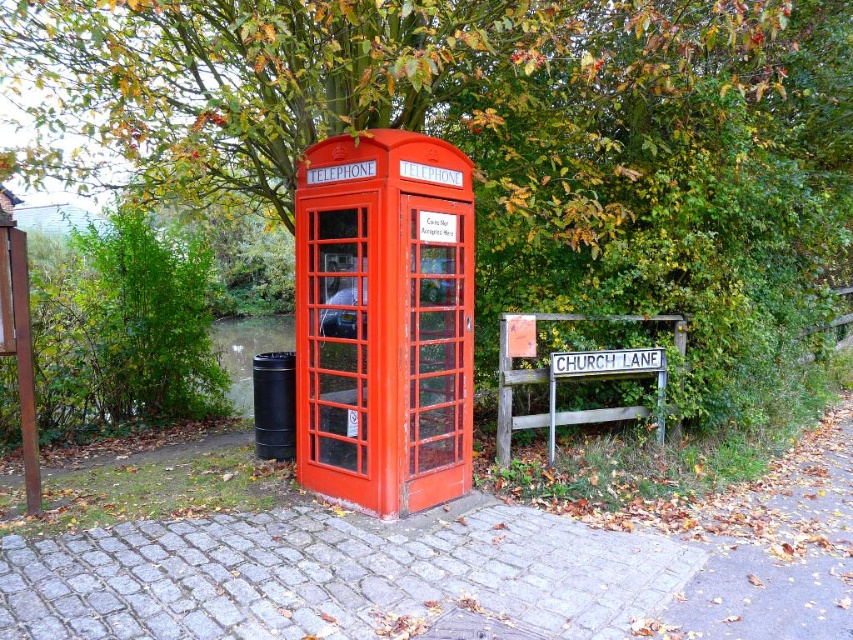
You are standing in front of the matte red telephone booth at center and want to look at the green leafy tree at upper center. In which direction should you turn your head?

You should turn your head to the left to see the green leafy tree at upper center, as it is located to the left of the matte red telephone booth at center.

What is located at the coordinates point (488, 129)?

The green leafy tree at upper center is located at point (488, 129).

In the scene shown: You are standing in front of the matte red telephone booth at center and want to see if the green leafy tree at upper center can fit next to it. Can the tree fit horizontally next to the telephone booth?

The green leafy tree at upper center is narrower than the matte red telephone booth at center, so it can fit horizontally next to it.